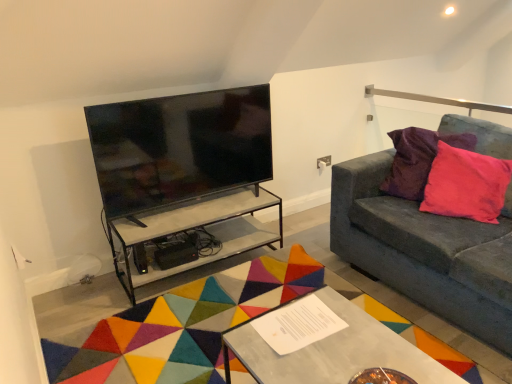
Question: Is pink velvet pillow at right facing away from black glossy tv at upper left?

Choices:
 (A) no
 (B) yes

Answer: (A)

Question: Is pink velvet pillow at right located outside black glossy tv at upper left?

Choices:
 (A) no
 (B) yes

Answer: (B)

Question: From the image's perspective, would you say pink velvet pillow at right is positioned over black glossy tv at upper left?

Choices:
 (A) yes
 (B) no

Answer: (B)

Question: From the image's perspective, is pink velvet pillow at right located beneath black glossy tv at upper left?

Choices:
 (A) no
 (B) yes

Answer: (B)

Question: Is pink velvet pillow at right positioned far away from black glossy tv at upper left?

Choices:
 (A) no
 (B) yes

Answer: (B)

Question: From the image's perspective, is clear glass table at center, the 2th table viewed from the front, positioned above or below black glossy tv at upper left?

Choices:
 (A) below
 (B) above

Answer: (A)

Question: Which is correct: clear glass table at center, which appears as the first table when viewed from the back, is inside black glossy tv at upper left, or outside of it?

Choices:
 (A) outside
 (B) inside

Answer: (A)

Question: Does point (232, 211) appear closer or farther from the camera than point (180, 100)?

Choices:
 (A) farther
 (B) closer

Answer: (A)

Question: Is clear glass table at center, which appears as the first table when viewed from the back, taller or shorter than black glossy tv at upper left?

Choices:
 (A) short
 (B) tall

Answer: (A)

Question: From a real-world perspective, relative to pink velvet pillow at right, is velvet grey couch at right vertically above or below?

Choices:
 (A) below
 (B) above

Answer: (A)

Question: Is velvet grey couch at right taller or shorter than pink velvet pillow at right?

Choices:
 (A) tall
 (B) short

Answer: (A)

Question: From the image's perspective, relative to pink velvet pillow at right, is velvet grey couch at right above or below?

Choices:
 (A) below
 (B) above

Answer: (A)

Question: Is velvet grey couch at right in front of or behind pink velvet pillow at right in the image?

Choices:
 (A) behind
 (B) front

Answer: (B)

Question: Is metallic silver table at center, which is the first table in front-to-back order, wider or thinner than clear glass table at center, the 2th table viewed from the front?

Choices:
 (A) thin
 (B) wide

Answer: (B)

Question: From the image's perspective, is metallic silver table at center, which is the first table in front-to-back order, positioned above or below clear glass table at center, which appears as the first table when viewed from the back?

Choices:
 (A) above
 (B) below

Answer: (B)